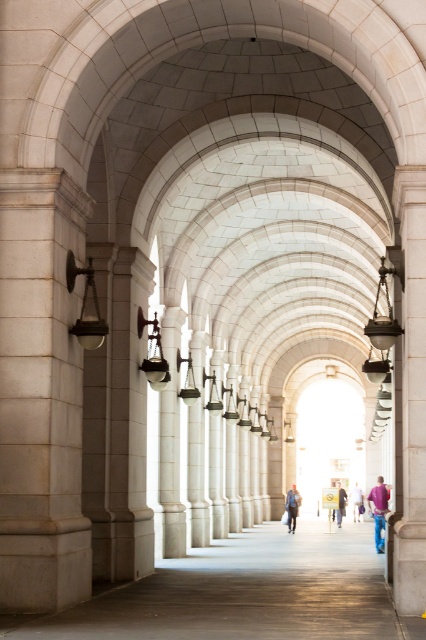
Who is higher up, purple cotton shirt at lower right or blue denim jacket at center?

blue denim jacket at center is above.

Who is more distant from viewer, [388,492] or [293,483]?

The point [293,483] is more distant.

At what (x,y) coordinates should I click in order to perform the action: click on purple cotton shirt at lower right. Please return your answer as a coordinate pair (x, y). This screenshot has height=640, width=426. Looking at the image, I should click on (379, 509).

Is point (69, 259) less distant than point (336, 513)?

Yes, point (69, 259) is in front of point (336, 513).

Which is behind, point (97, 305) or point (337, 506)?

Point (337, 506)

Does point (88, 291) come farther from viewer compared to point (339, 509)?

No, it is not.

Where is `matte glass lamp at left`? The image size is (426, 640). matte glass lamp at left is located at coordinates (86, 305).

Between blue denim jacket at center and blue jeans at center, which one appears on the left side from the viewer's perspective?

Positioned to the left is blue denim jacket at center.

Find the location of `blue denim jacket at center`. blue denim jacket at center is located at coordinates (291, 508).

Where is `blue denim jacket at center`? The height and width of the screenshot is (640, 426). blue denim jacket at center is located at coordinates (291, 508).